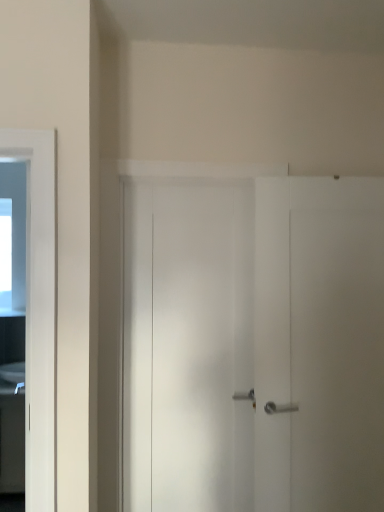
Question: In the image, is white glossy sink at left positioned in front of or behind black glossy cabinet at left?

Choices:
 (A) front
 (B) behind

Answer: (B)

Question: Would you say white glossy sink at left is to the left or to the right of black glossy cabinet at left in the picture?

Choices:
 (A) left
 (B) right

Answer: (B)

Question: From the image's perspective, is white glossy sink at left above or below black glossy cabinet at left?

Choices:
 (A) below
 (B) above

Answer: (B)

Question: Considering the relative positions of black glossy cabinet at left and white glossy sink at left in the image provided, is black glossy cabinet at left to the left or to the right of white glossy sink at left?

Choices:
 (A) right
 (B) left

Answer: (B)

Question: In terms of height, does black glossy cabinet at left look taller or shorter compared to white glossy sink at left?

Choices:
 (A) tall
 (B) short

Answer: (A)

Question: From the image's perspective, is black glossy cabinet at left above or below white glossy sink at left?

Choices:
 (A) above
 (B) below

Answer: (B)

Question: Based on their sizes in the image, would you say black glossy cabinet at left is bigger or smaller than white glossy sink at left?

Choices:
 (A) small
 (B) big

Answer: (B)